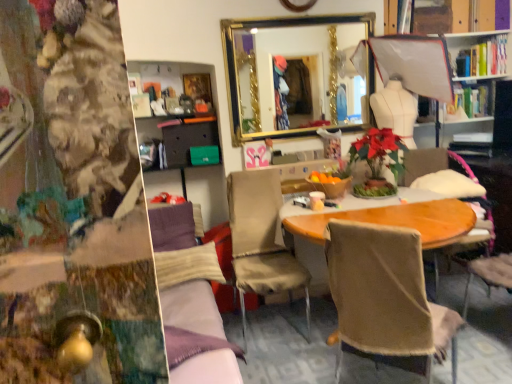
What is the approximate width of gold-framed mirror at upper center?

gold-framed mirror at upper center is 3.00 inches in width.

This screenshot has height=384, width=512. What do you see at coordinates (483, 58) in the screenshot? I see `hardcover books at upper right` at bounding box center [483, 58].

Identify the location of beige fabric chair at center, which is the third chair in right-to-left order. (261, 240).

Considering the sizes of beige fabric chair at center, which is the third chair in right-to-left order, and beige fabric chair at center, placed as the 2th chair when sorted from right to left, in the image, is beige fabric chair at center, which is the third chair in right-to-left order, taller or shorter than beige fabric chair at center, placed as the 2th chair when sorted from right to left,?

beige fabric chair at center, which is the third chair in right-to-left order, is shorter than beige fabric chair at center, placed as the 2th chair when sorted from right to left.

Is beige fabric chair at center, which is the third chair in right-to-left order, touching beige fabric chair at center, placed as the 2th chair when sorted from right to left?

No, beige fabric chair at center, which is the third chair in right-to-left order, is not next to beige fabric chair at center, placed as the 2th chair when sorted from right to left.

Which of these two, beige fabric chair at center, which is the third chair in right-to-left order, or beige fabric chair at center, placed as the 2th chair when sorted from right to left, is thinner?

With smaller width is beige fabric chair at center, placed as the 2th chair when sorted from right to left.

From the image's perspective, which object appears higher, hardcover books at upper right or wooden chair at center, marked as the 1th chair in a right-to-left arrangement?

hardcover books at upper right appears higher in the image.

Identify the location of chair that is the 1st object located in front of the hardcover books at upper right. (431, 163).

Relative to wooden chair at center, marked as the 1th chair in a right-to-left arrangement, is hardcover books at upper right in front or behind?

hardcover books at upper right is behind wooden chair at center, marked as the 1th chair in a right-to-left arrangement.

From a real-world perspective, is hardcover books at upper right physically below wooden chair at center, marked as the 1th chair in a right-to-left arrangement?

Incorrect, from a real-world perspective, hardcover books at upper right is higher than wooden chair at center, marked as the 1th chair in a right-to-left arrangement.

Considering the relative positions of matte gray drawer at center-left and beige fabric chair at center, which ranks as the 2th chair in left-to-right order, in the image provided, is matte gray drawer at center-left to the left of beige fabric chair at center, which ranks as the 2th chair in left-to-right order, from the viewer's perspective?

Yes.

From the image's perspective, which object appears higher, matte gray drawer at center-left or beige fabric chair at center, which ranks as the 2th chair in left-to-right order?

From the image's view, matte gray drawer at center-left is above.

Considering the sizes of objects matte gray drawer at center-left and beige fabric chair at center, which ranks as the 2th chair in left-to-right order, in the image provided, who is smaller, matte gray drawer at center-left or beige fabric chair at center, which ranks as the 2th chair in left-to-right order,?

matte gray drawer at center-left is smaller.

Who is shorter, matte gray drawer at center-left or beige fabric chair at center, which ranks as the 2th chair in left-to-right order?

With less height is matte gray drawer at center-left.

From the picture: In the image, is beige fabric chair at center, which is the third chair in right-to-left order, positioned in front of or behind gold-framed mirror at upper center?

Clearly, beige fabric chair at center, which is the third chair in right-to-left order, is in front of gold-framed mirror at upper center.

Can you confirm if beige fabric chair at center, which is the third chair in right-to-left order, is positioned to the left of gold-framed mirror at upper center?

A: Yes, beige fabric chair at center, which is the third chair in right-to-left order, is to the left of gold-framed mirror at upper center.

From a real-world perspective, is beige fabric chair at center, which is the third chair in right-to-left order, located beneath gold-framed mirror at upper center?

Yes.

Which of these two, beige fabric chair at center, which is the third chair in right-to-left order, or gold-framed mirror at upper center, is bigger?

Bigger between the two is beige fabric chair at center, which is the third chair in right-to-left order.

Can you confirm if beige fabric chair at center, placed as the 2th chair when sorted from right to left, is shorter than hardcover books at upper right?

Incorrect, the height of beige fabric chair at center, placed as the 2th chair when sorted from right to left, does not fall short of that of hardcover books at upper right.

From the image's perspective, is beige fabric chair at center, which ranks as the 2th chair in left-to-right order, on top of hardcover books at upper right?

No.

Is hardcover books at upper right inside beige fabric chair at center, placed as the 2th chair when sorted from right to left?

Definitely not — hardcover books at upper right is not inside beige fabric chair at center, placed as the 2th chair when sorted from right to left.

How much distance is there between beige fabric chair at center, which ranks as the 2th chair in left-to-right order, and hardcover books at upper right?

beige fabric chair at center, which ranks as the 2th chair in left-to-right order, is 8.86 feet away from hardcover books at upper right.

Can you confirm if beige fabric chair at center, placed as the 2th chair when sorted from right to left, is positioned to the right of velvet purple couch at center?

Indeed, beige fabric chair at center, placed as the 2th chair when sorted from right to left, is positioned on the right side of velvet purple couch at center.

Considering the sizes of beige fabric chair at center, placed as the 2th chair when sorted from right to left, and velvet purple couch at center in the image, is beige fabric chair at center, placed as the 2th chair when sorted from right to left, bigger or smaller than velvet purple couch at center?

Clearly, beige fabric chair at center, placed as the 2th chair when sorted from right to left, is smaller in size than velvet purple couch at center.

In the image, is beige fabric chair at center, placed as the 2th chair when sorted from right to left, positioned in front of or behind velvet purple couch at center?

Visually, beige fabric chair at center, placed as the 2th chair when sorted from right to left, is located behind velvet purple couch at center.

Is velvet purple couch at center not within beige fabric chair at center, the first chair when ordered from left to right?

That's correct, velvet purple couch at center is outside of beige fabric chair at center, the first chair when ordered from left to right.

Would you consider velvet purple couch at center to be distant from beige fabric chair at center, which is the third chair in right-to-left order?

velvet purple couch at center is actually quite close to beige fabric chair at center, which is the third chair in right-to-left order.

Is point (165, 321) positioned before point (268, 237)?

Yes.

Between velvet purple couch at center and beige fabric chair at center, the first chair when ordered from left to right, which one is positioned behind?

beige fabric chair at center, the first chair when ordered from left to right, is behind.

This screenshot has width=512, height=384. In order to click on chair in front of the beige fabric chair at center, the first chair when ordered from left to right in this screenshot , I will do `click(383, 305)`.

The width and height of the screenshot is (512, 384). Find the location of `the 1st chair to the left of the hardcover books at upper right, starting your count from the anchor`. the 1st chair to the left of the hardcover books at upper right, starting your count from the anchor is located at coordinates pos(431,163).

Considering their positions, is beige fabric chair at center, which is the third chair in right-to-left order, positioned closer to hardcover books at upper right than wooden chair at center, acting as the 3th chair starting from the left?

wooden chair at center, acting as the 3th chair starting from the left, is positioned closer to the anchor hardcover books at upper right.

Which object lies further to the anchor point hardcover books at upper right, beige fabric chair at center, which is the third chair in right-to-left order, or velvet purple couch at center?

velvet purple couch at center is further to hardcover books at upper right.

When comparing their distances from wooden chair at center, acting as the 3th chair starting from the left, does velvet purple couch at center or beige fabric chair at center, which is the third chair in right-to-left order, seem closer?

beige fabric chair at center, which is the third chair in right-to-left order, is positioned closer to the anchor wooden chair at center, acting as the 3th chair starting from the left.

Which object lies nearer to the anchor point matte gray drawer at center-left, hardcover books at upper right or wooden chair at center, acting as the 3th chair starting from the left?

Among the two, wooden chair at center, acting as the 3th chair starting from the left, is located nearer to matte gray drawer at center-left.

Considering their positions, is beige fabric chair at center, placed as the 2th chair when sorted from right to left, positioned closer to gold-framed mirror at upper center than beige fabric chair at center, which is the third chair in right-to-left order?

beige fabric chair at center, which is the third chair in right-to-left order, is positioned closer to the anchor gold-framed mirror at upper center.

In the scene shown: Which object lies further to the anchor point gold-framed mirror at upper center, wooden chair at center, acting as the 3th chair starting from the left, or hardcover books at upper right?

hardcover books at upper right is positioned further to the anchor gold-framed mirror at upper center.

Estimate the real-world distances between objects in this image. Which object is further from matte gray drawer at center-left, velvet purple couch at center or gold-framed mirror at upper center?

velvet purple couch at center lies further to matte gray drawer at center-left than the other object.

Looking at the image, which one is located closer to wooden chair at center, marked as the 1th chair in a right-to-left arrangement, beige fabric chair at center, which is the third chair in right-to-left order, or gold-framed mirror at upper center?

gold-framed mirror at upper center is positioned closer to the anchor wooden chair at center, marked as the 1th chair in a right-to-left arrangement.

At what (x,y) coordinates should I click in order to perform the action: click on mirror between matte gray drawer at center-left and wooden chair at center, acting as the 3th chair starting from the left. Please return your answer as a coordinate pair (x, y). This screenshot has width=512, height=384. Looking at the image, I should click on [x=273, y=74].

Where is `chair between beige fabric chair at center, which is the third chair in right-to-left order, and wooden chair at center, marked as the 1th chair in a right-to-left arrangement`? This screenshot has width=512, height=384. chair between beige fabric chair at center, which is the third chair in right-to-left order, and wooden chair at center, marked as the 1th chair in a right-to-left arrangement is located at coordinates (383, 305).

This screenshot has width=512, height=384. I want to click on couch situated between matte gray drawer at center-left and hardcover books at upper right from left to right, so click(190, 300).

Image resolution: width=512 pixels, height=384 pixels. Identify the location of mirror situated between beige fabric chair at center, which is the third chair in right-to-left order, and wooden chair at center, acting as the 3th chair starting from the left, from left to right. (273, 74).